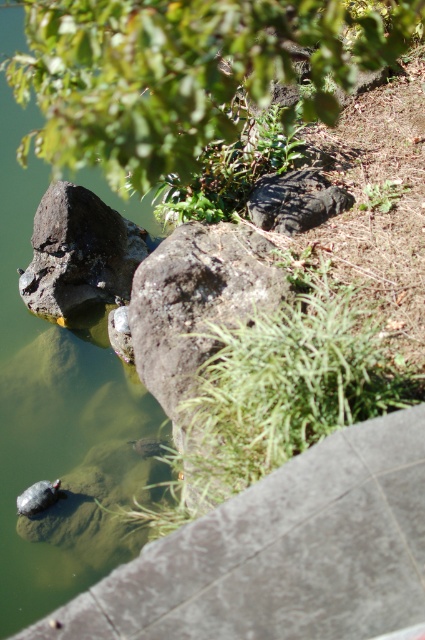
You are standing at the center of the image. Which direction should you move to reach the green stone water at left?

You should move to the left to reach the green stone water at left since it is located at the left side of the image.

You are standing at the edge of the pond and want to reach a specific point marked at coordinates point [376,12]. If your maximum comfortable walking distance is 4 meters, can you comfortably reach that point without wading into deeper water?

The distance of point [376,12] from viewer is 3.98 meters, which is within your maximum comfortable walking distance of 4 meters. Therefore, you can comfortably reach that point without wading into deeper water.

From the picture: You are a small frog trying to jump from the green stone water at left to the rough textured rock at left. Given that your maximum jump distance is 18 inches, can you safely make the leap?

The distance between the green stone water at left and the rough textured rock at left is 20.09 inches, which is greater than your maximum jump distance of 18 inches. Therefore, you cannot safely make the leap.